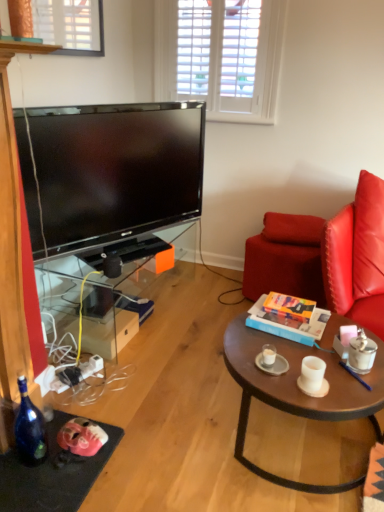
The image size is (384, 512). I want to click on free space above brown wooden coffee table at center (from a real-world perspective), so click(x=301, y=354).